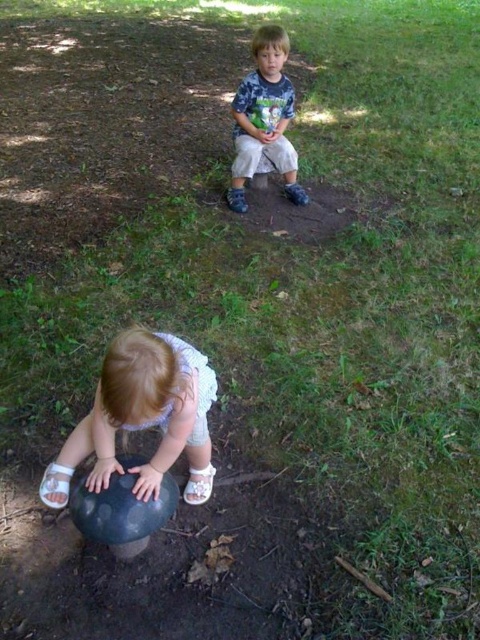
Does point (74, 429) come in front of point (291, 182)?

Yes.

Consider the image. Between smooth white sand at lower left and matte blue shirt at upper center, which one has less height?

smooth white sand at lower left is shorter.

Is point (152, 372) farther from viewer compared to point (232, 198)?

No, it is in front of (232, 198).

This screenshot has width=480, height=640. Find the location of `smooth white sand at lower left`. smooth white sand at lower left is located at coordinates (143, 417).